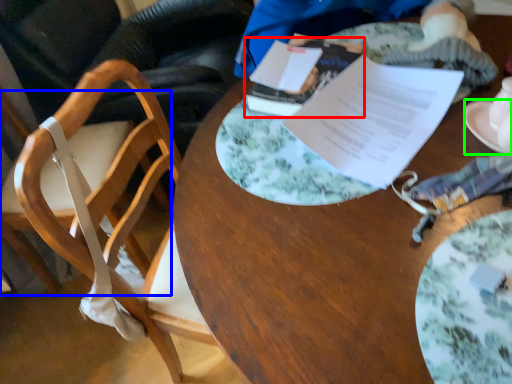
Question: Which is nearer to the journal (highlighted by a red box)? chair (highlighted by a blue box) or saucer (highlighted by a green box).

Choices:
 (A) chair
 (B) saucer

Answer: (B)